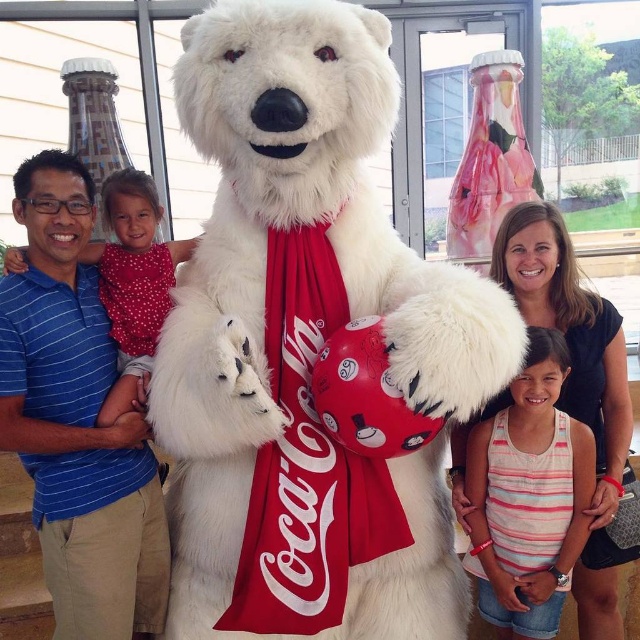
Question: Which object is farther from the camera taking this photo?

Choices:
 (A) striped tank top at center
 (B) white fluffy bear at upper left

Answer: (A)

Question: Is white plush teddy bear at center to the right of striped tank top at center from the viewer's perspective?

Choices:
 (A) yes
 (B) no

Answer: (B)

Question: Among these objects, which one is nearest to the camera?

Choices:
 (A) striped tank top at center
 (B) white plush teddy bear at center
 (C) white fluffy bear at upper left

Answer: (B)

Question: Can you confirm if striped tank top at center is positioned to the left of white fluffy bear at upper left?

Choices:
 (A) yes
 (B) no

Answer: (B)

Question: Is striped tank top at center positioned at the back of white fluffy bear at upper left?

Choices:
 (A) no
 (B) yes

Answer: (B)

Question: Among these points, which one is nearest to the camera?

Choices:
 (A) (500, 410)
 (B) (204, 96)
 (C) (120, 323)

Answer: (B)